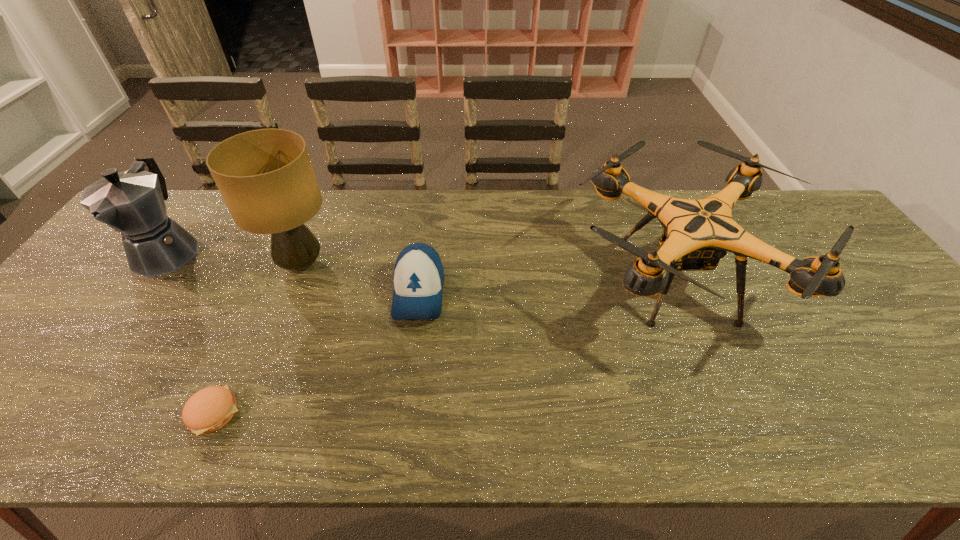
In the image, there is a desktop. At what (x,y) coordinates should I click in order to perform the action: click on free region at the left edge. Please return your answer as a coordinate pair (x, y). The height and width of the screenshot is (540, 960). Looking at the image, I should click on (124, 252).

You are a GUI agent. You are given a task and a screenshot of the screen. Output one action in this format:
    pyautogui.click(x=<x>, y=<y>)
    Task: Click on the vacant space at the far left corner of the desktop
    
    Given the screenshot: What is the action you would take?
    pyautogui.click(x=175, y=204)

Where is `vacant space at the far right corner of the desktop`? This screenshot has width=960, height=540. vacant space at the far right corner of the desktop is located at coordinates (817, 234).

What are the coordinates of `free space that is in between the leftmost object and the second shortest object` in the screenshot? It's located at (293, 272).

Locate an element on the screen. free space between the second object from right to left and the patty is located at coordinates (317, 353).

You are a GUI agent. You are given a task and a screenshot of the screen. Output one action in this format:
    pyautogui.click(x=<x>, y=<y>)
    Task: Click on the vacant space that is in between the drone and the patty
    
    Given the screenshot: What is the action you would take?
    pyautogui.click(x=444, y=346)

Image resolution: width=960 pixels, height=540 pixels. Find the location of `vacant space in between the coffeepot and the tallest object`. vacant space in between the coffeepot and the tallest object is located at coordinates (234, 258).

This screenshot has width=960, height=540. Identify the location of vacant area between the drone and the baseball cap. (547, 287).

Where is `vacant space in between the nearest object and the second shortest object`? The height and width of the screenshot is (540, 960). vacant space in between the nearest object and the second shortest object is located at coordinates (317, 353).

Find the location of `free point between the second object from right to left and the lampshade`. free point between the second object from right to left and the lampshade is located at coordinates (360, 279).